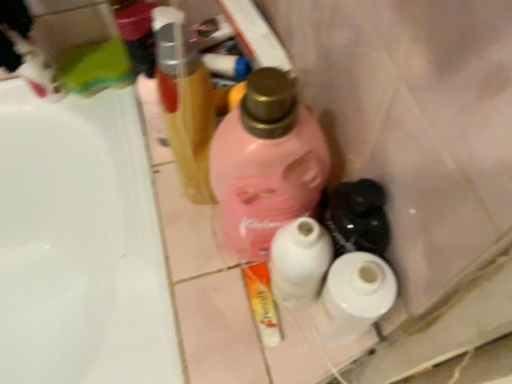
Question: Is point (31, 359) positioned closer to the camera than point (263, 271)?

Choices:
 (A) closer
 (B) farther

Answer: (B)

Question: From the image's perspective, is white glossy sink at left located above or below white glossy tube at center?

Choices:
 (A) below
 (B) above

Answer: (A)

Question: Considering the real-world distances, which object is farthest from the metallic gold hairbrush at upper center, the second bottle positioned from the right?

Choices:
 (A) white matte toilet paper at center, the 1th toilet paper when ordered from left to right
 (B) pink matte bottle at center, positioned as the 2th bottle in left-to-right order
 (C) white glossy tube at center
 (D) white matte toilet paper at center, acting as the first toilet paper starting from the right
 (E) white glossy sink at left

Answer: (E)

Question: Based on their relative distances, which object is farther from the white glossy sink at left?

Choices:
 (A) white matte toilet paper at center, the 1th toilet paper when ordered from left to right
 (B) pink matte bottle at center, which is the 1th bottle from right to left
 (C) white glossy tube at center
 (D) metallic gold hairbrush at upper center, the second bottle positioned from the right
 (E) white matte toilet paper at center, acting as the first toilet paper starting from the right

Answer: (E)